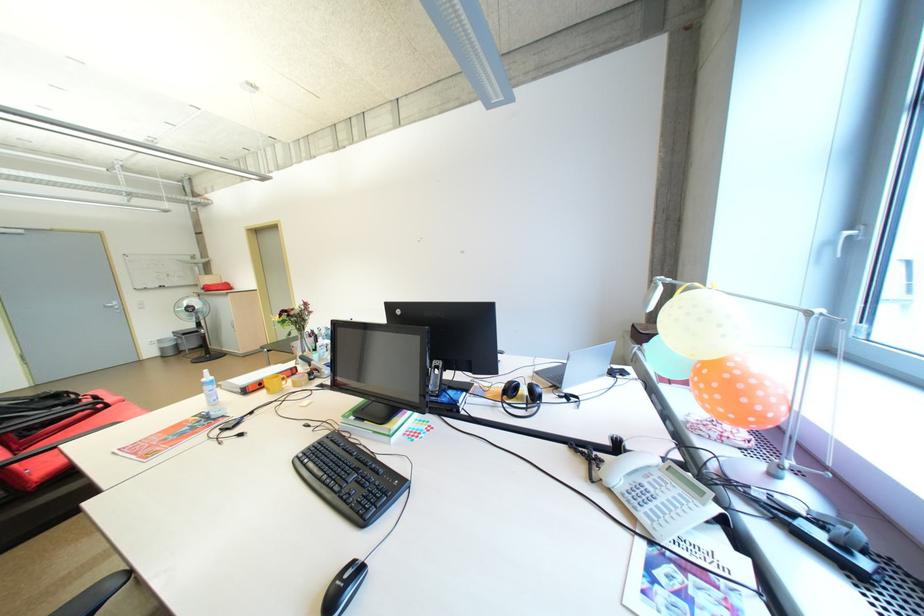
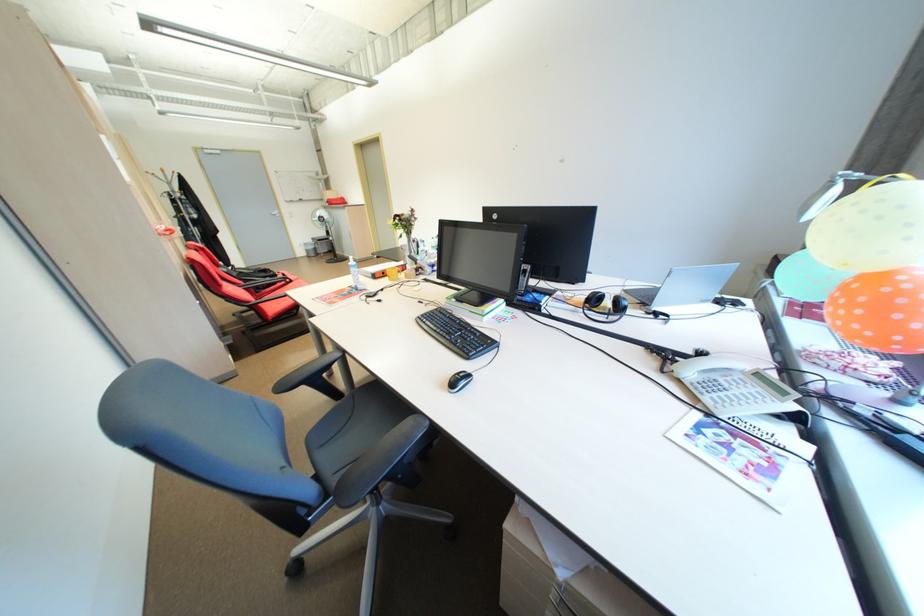
Locate, in the second image, the point that corresponds to (545,374) in the first image.

(635, 292)